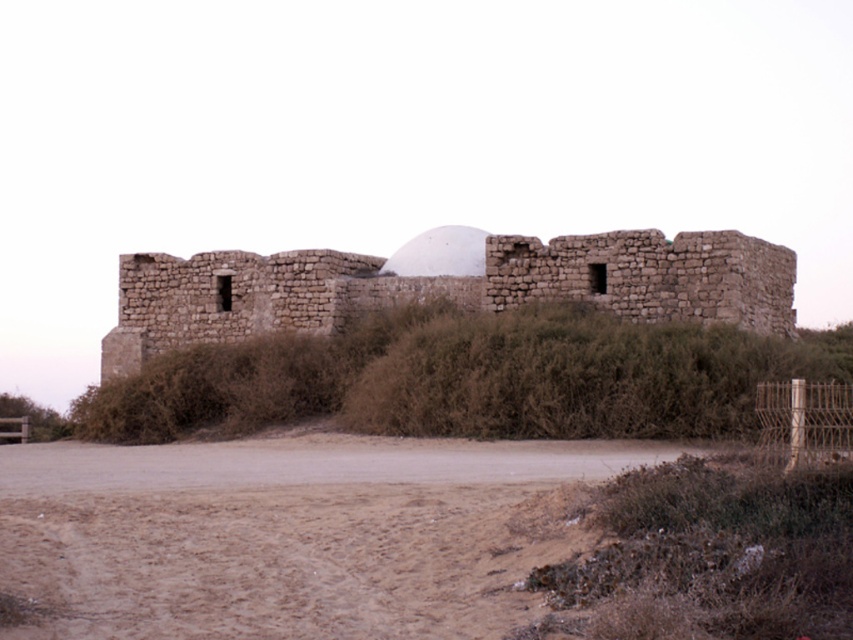
Question: In this image, where is brown sandy dirt field at lower left located relative to brown stone ruins at center?

Choices:
 (A) right
 (B) left

Answer: (B)

Question: Which of the following is the farthest from the observer?

Choices:
 (A) (136, 288)
 (B) (64, 442)

Answer: (A)

Question: Among these objects, which one is farthest from the camera?

Choices:
 (A) brown sandy dirt field at lower left
 (B) brown stone ruins at center

Answer: (B)

Question: Can you confirm if brown sandy dirt field at lower left is positioned below brown stone ruins at center?

Choices:
 (A) yes
 (B) no

Answer: (A)

Question: Is brown sandy dirt field at lower left below brown stone ruins at center?

Choices:
 (A) yes
 (B) no

Answer: (A)